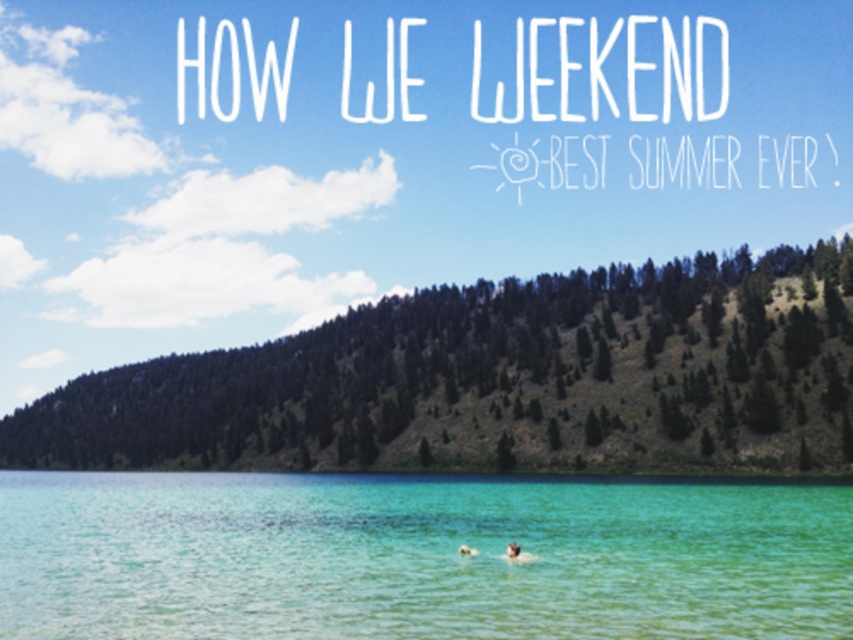
Question: Does clear water at center have a lesser width compared to smooth skin person at center?

Choices:
 (A) no
 (B) yes

Answer: (A)

Question: Is clear water at center closer to the viewer compared to smooth skin person at center?

Choices:
 (A) yes
 (B) no

Answer: (A)

Question: Is clear water at center to the left of smooth skin person at center from the viewer's perspective?

Choices:
 (A) yes
 (B) no

Answer: (A)